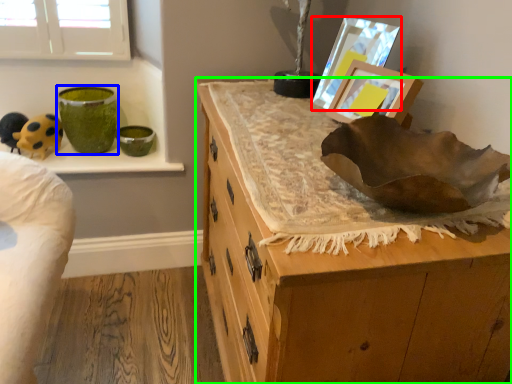
Question: Which is nearer to the picture frame (highlighted by a red box)? glass vase (highlighted by a blue box) or chest of drawers (highlighted by a green box).

Choices:
 (A) glass vase
 (B) chest of drawers

Answer: (B)